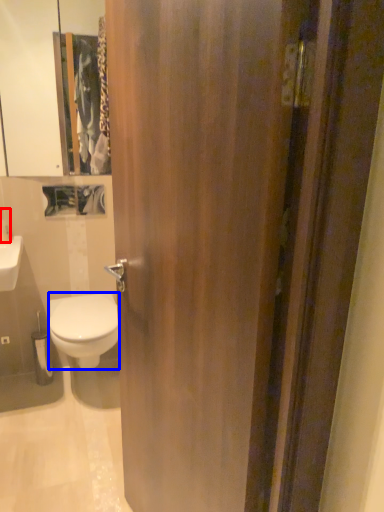
Question: Which of the following is the closest to the observer, toiletry (highlighted by a red box) or bidet (highlighted by a blue box)?

Choices:
 (A) toiletry
 (B) bidet

Answer: (B)